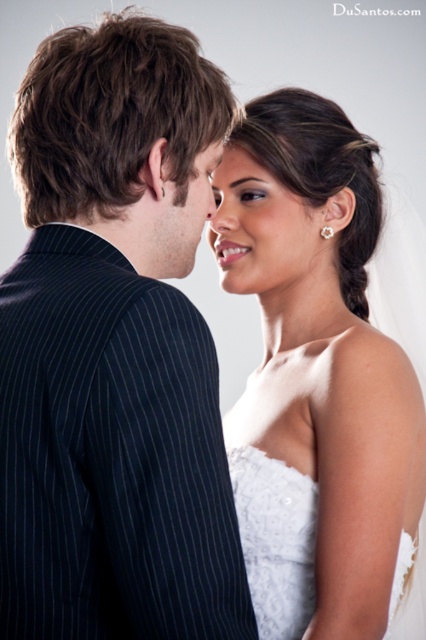
Question: Which object appears farthest from the camera in this image?

Choices:
 (A) dark blue pinstripe suit at left
 (B) smooth skin forehead at upper center
 (C) white lace dress at right
 (D) matte skin face at center

Answer: (B)

Question: Which point appears closest to the camera in this image?

Choices:
 (A) (244, 451)
 (B) (232, 161)
 (C) (255, 436)
 (D) (259, 150)

Answer: (A)

Question: Can you confirm if smooth skin face at center is positioned to the left of matte skin face at center?

Choices:
 (A) yes
 (B) no

Answer: (B)

Question: Can you confirm if white lace dress at right is positioned to the left of smooth skin forehead at upper center?

Choices:
 (A) yes
 (B) no

Answer: (B)

Question: Can you confirm if white lace dress at right is positioned above white lace wedding dress at center?

Choices:
 (A) yes
 (B) no

Answer: (A)

Question: Which point is farther to the camera?

Choices:
 (A) smooth skin forehead at upper center
 (B) white lace wedding dress at center
 (C) matte skin face at center
 (D) white lace dress at right

Answer: (A)